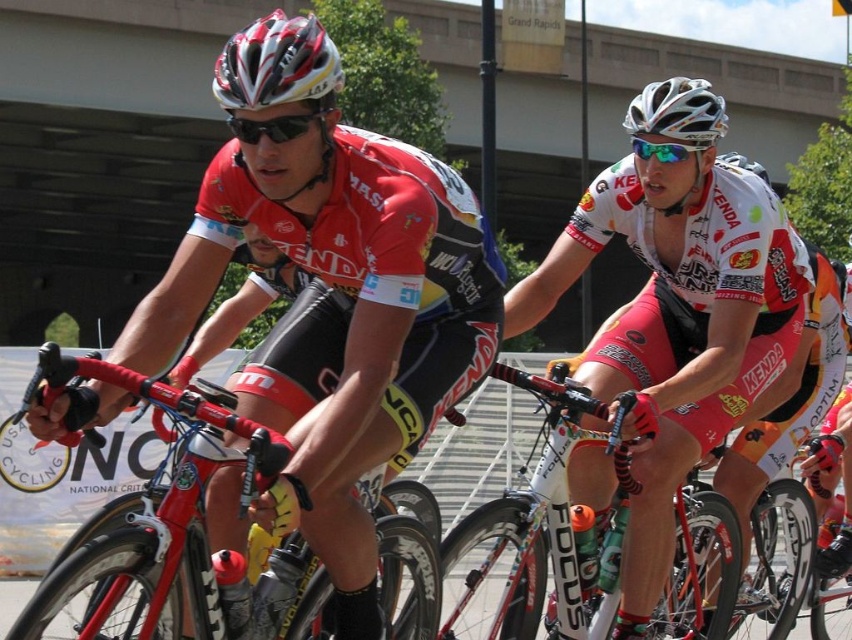
Is point (749, 323) behind point (320, 38)?

Yes, point (749, 323) is behind point (320, 38).

Can you confirm if white matte helmet at upper center is positioned below matte white and black helmet at upper center?

Correct, white matte helmet at upper center is located below matte white and black helmet at upper center.

I want to click on white matte helmet at upper center, so (676, 324).

Which is in front, point (151, 502) or point (268, 29)?

Point (151, 502) is in front.

Can you confirm if shiny red bicycle at left is positioned above matte white and black helmet at upper center?

Actually, shiny red bicycle at left is below matte white and black helmet at upper center.

Who is more forward, (286, 547) or (246, 35)?

Point (246, 35)

Locate an element on the screen. Image resolution: width=852 pixels, height=640 pixels. shiny red bicycle at left is located at coordinates (150, 513).

Does matte black bicycle at center appear on the right side of white glossy bicycle at center?

No, matte black bicycle at center is not to the right of white glossy bicycle at center.

The width and height of the screenshot is (852, 640). What do you see at coordinates (337, 316) in the screenshot?
I see `matte black bicycle at center` at bounding box center [337, 316].

This screenshot has height=640, width=852. In order to click on matte black bicycle at center in this screenshot , I will do `click(337, 316)`.

Locate an element on the screen. The image size is (852, 640). matte black bicycle at center is located at coordinates (337, 316).